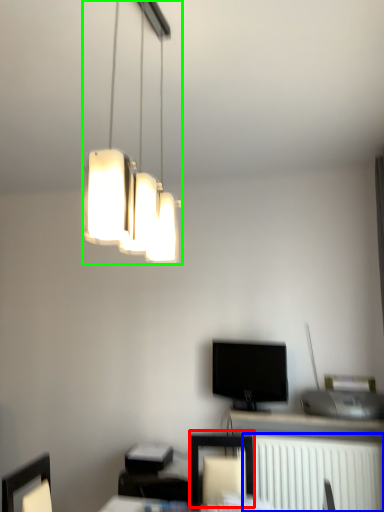
Question: Which object is the farthest from furniture (highlighted by a red box)? Choose among these: radiator (highlighted by a blue box) or lamp (highlighted by a green box).

Choices:
 (A) radiator
 (B) lamp

Answer: (B)